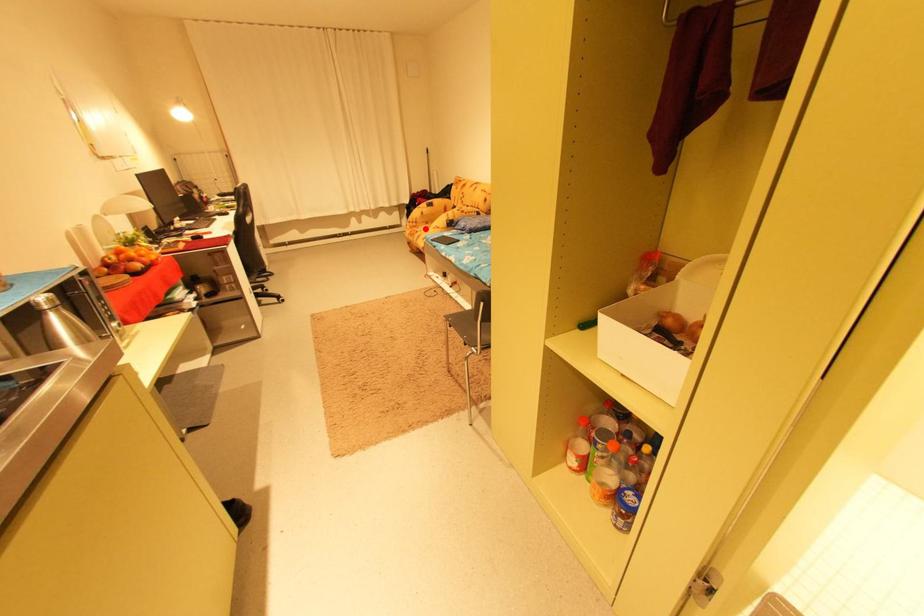
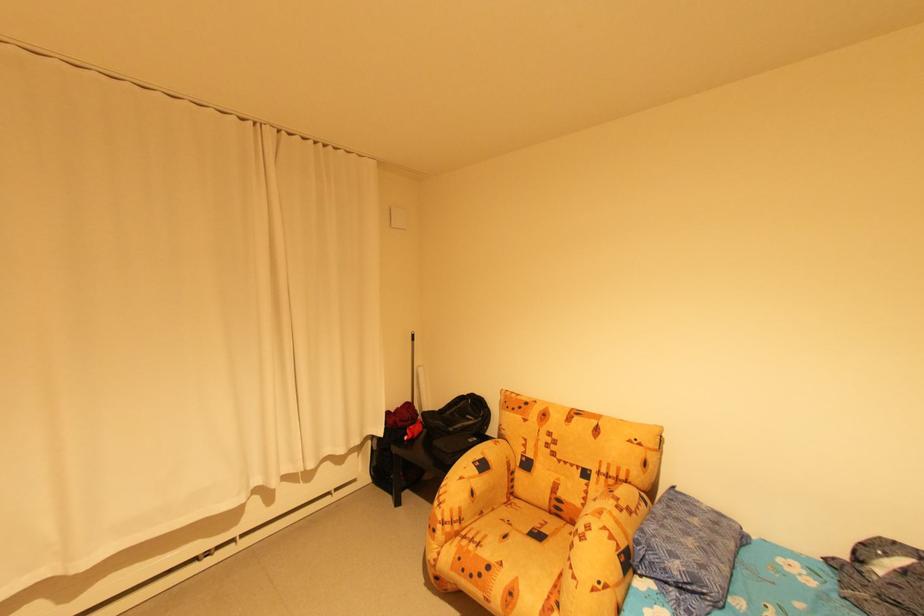
Find the pixel in the second image that matches the highlighted location in the first image.

(485, 545)